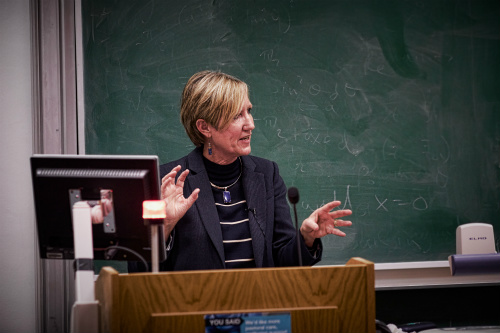
At what (x,y) coordinates should I click in order to perform the action: click on wall. Please return your answer as a coordinate pair (x, y). Looking at the image, I should click on (11, 35), (11, 205).